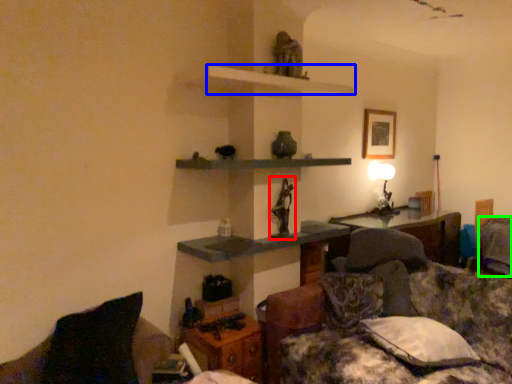
Question: Based on their relative distances, which object is nearer to sculpture (highlighted by a red box)? Choose from shelf (highlighted by a blue box) and pillow (highlighted by a green box).

Choices:
 (A) shelf
 (B) pillow

Answer: (A)